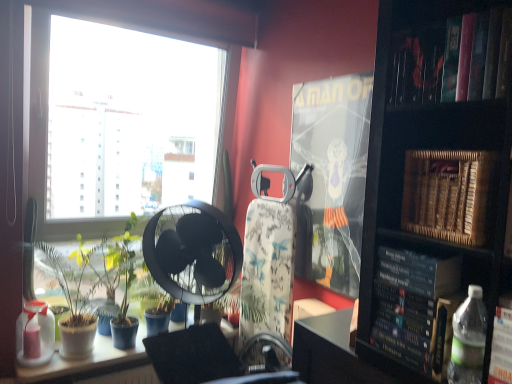
Question: Is point (373, 321) positioned closer to the camera than point (449, 72)?

Choices:
 (A) farther
 (B) closer

Answer: (A)

Question: Is hardcover book at right, which appears as the second paperback book when viewed from the front, taller or shorter than hardcover book at upper right?

Choices:
 (A) tall
 (B) short

Answer: (A)

Question: Which object is the closest to the metallic swivel chair at center?

Choices:
 (A) hardcover book at upper right
 (B) hardcover book at right, which appears as the 2th paperback book when viewed from the back
 (C) white glossy table at lower left
 (D) matte plastic paperback book at center, arranged as the first paperback book when viewed from the back
 (E) green leafy plant at window, the 1th plant when ordered from right to left

Answer: (C)

Question: Based on their relative distances, which object is nearer to the translucent plastic bottle at lower left, the 1th bottle when ordered from bottom to top?

Choices:
 (A) white glossy table at lower left
 (B) green matte plant at lower left, positioned as the second plant in right-to-left order
 (C) clear plastic bottle at lower right, the second bottle viewed from the back
 (D) wooden piano at right, the third paperback book from the back
 (E) hardcover book at right, which appears as the second paperback book when viewed from the front

Answer: (A)